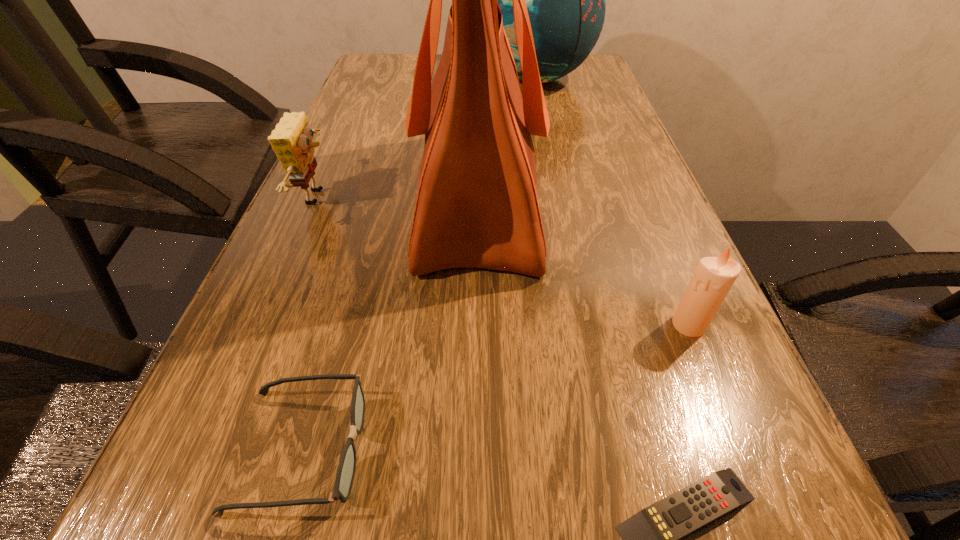
You are a GUI agent. You are given a task and a screenshot of the screen. Output one action in this format:
    pyautogui.click(x=<x>, y=<y>)
    Task: Click on the shopping bag
    
    Given the screenshot: What is the action you would take?
    pyautogui.click(x=477, y=206)

At what (x,y) coordinates should I click in order to perform the action: click on globe. Please return your answer as a coordinate pair (x, y). This screenshot has height=540, width=960. Looking at the image, I should click on (566, 0).

I want to click on the farthest object, so click(566, 0).

Identify the location of sponge. (291, 140).

Where is `the third nearest object`? the third nearest object is located at coordinates (713, 278).

Find the location of a particular element. The width and height of the screenshot is (960, 540). the fifth object from right to left is located at coordinates (345, 473).

The height and width of the screenshot is (540, 960). What are the coordinates of `the fifth tallest object` in the screenshot? It's located at (345, 473).

Find the location of a particular element. This screenshot has width=960, height=540. free space located on the front pocket of the shopping bag is located at coordinates (635, 197).

I want to click on vacant space located on the left of the farthest object, so click(359, 78).

Identify the location of vacant space situated 0.210m on the face of the leftmost object. (435, 197).